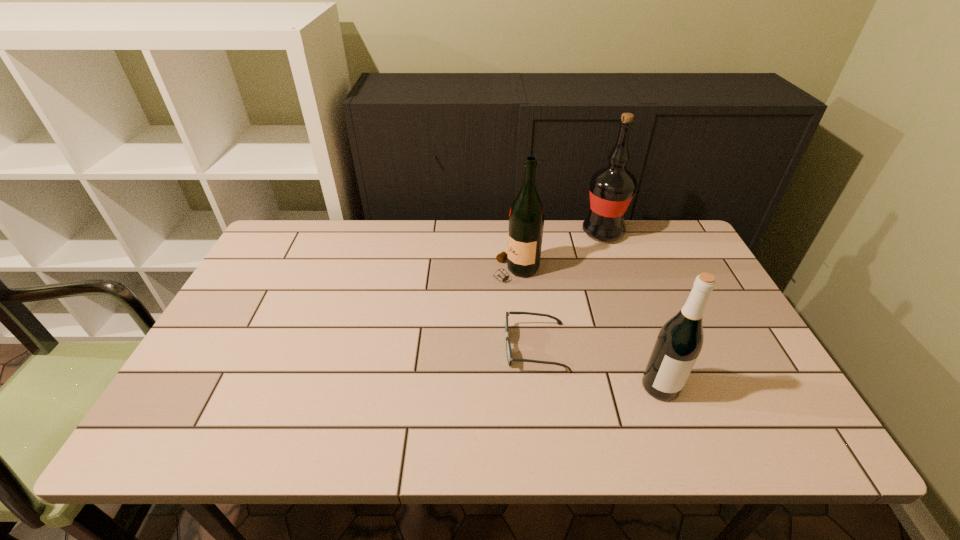
At what (x,y) coordinates should I click in order to perform the action: click on vacant space positioned on the face of the spectacles. Please return your answer as a coordinate pair (x, y). The height and width of the screenshot is (540, 960). Looking at the image, I should click on (371, 347).

This screenshot has height=540, width=960. Identify the location of vacant space located 0.100m on the face of the spectacles. (464, 347).

The height and width of the screenshot is (540, 960). What are the coordinates of `vacant space located on the face of the spectacles` in the screenshot? It's located at coord(448,347).

Locate an element on the screen. The image size is (960, 540). free space at the far edge of the desktop is located at coordinates (413, 239).

The height and width of the screenshot is (540, 960). In the image, there is a desktop. In order to click on free space at the near edge in this screenshot , I will do `click(354, 422)`.

In the image, there is a desktop. Identify the location of vacant space at the left edge. (202, 378).

You are a GUI agent. You are given a task and a screenshot of the screen. Output one action in this format:
    pyautogui.click(x=<x>, y=<y>)
    Task: Click on the free region at the far left corner
    This screenshot has height=540, width=960.
    Given the screenshot: What is the action you would take?
    pyautogui.click(x=291, y=238)

This screenshot has height=540, width=960. What are the coordinates of `vacant space at the near right corner` in the screenshot? It's located at (767, 435).

Identify the location of free space between the nearest wine bottle and the third nearest object. (588, 328).

Find the location of a particular element. Image resolution: width=960 pixels, height=540 pixels. vacant area that lies between the spectacles and the second nearest wine bottle is located at coordinates (525, 308).